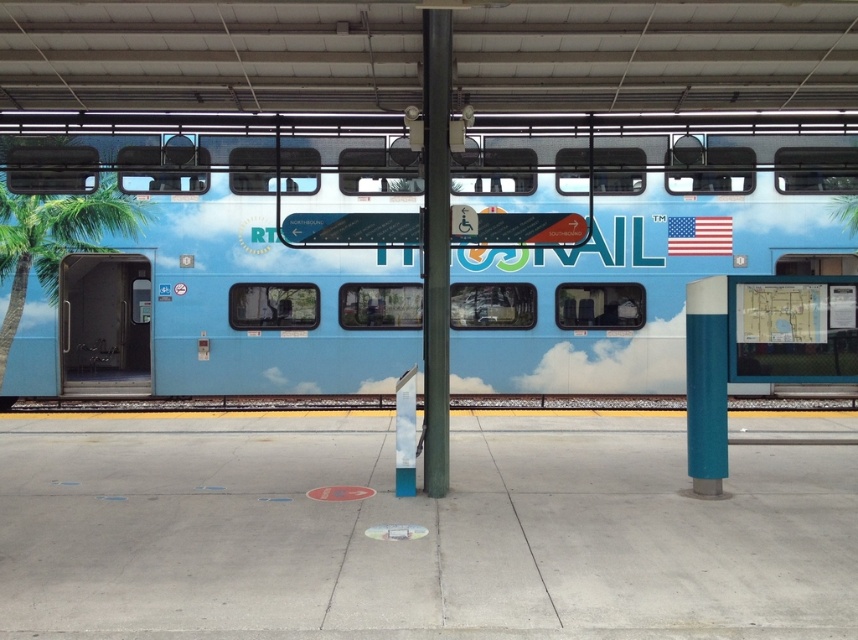
Can you confirm if light blue glossy train at center is smaller than green painted metal pole at center?

Incorrect, light blue glossy train at center is not smaller in size than green painted metal pole at center.

Can you confirm if light blue glossy train at center is positioned to the left of green painted metal pole at center?

Correct, you'll find light blue glossy train at center to the left of green painted metal pole at center.

Does point (813, 262) come behind point (433, 147)?

Yes, it is behind point (433, 147).

You are a GUI agent. You are given a task and a screenshot of the screen. Output one action in this format:
    pyautogui.click(x=<x>, y=<y>)
    Task: Click on the light blue glossy train at center
    The height and width of the screenshot is (640, 858).
    Given the screenshot: What is the action you would take?
    pyautogui.click(x=230, y=273)

Does point (536, 237) come behind point (22, 230)?

No, (536, 237) is closer to viewer.

At what (x,y) coordinates should I click in order to perform the action: click on light blue glossy train at center. Please return your answer as a coordinate pair (x, y). This screenshot has height=640, width=858. Looking at the image, I should click on (230, 273).

The width and height of the screenshot is (858, 640). Find the location of `green painted metal pole at center`. green painted metal pole at center is located at coordinates (434, 248).

Does point (438, 134) come behind point (5, 326)?

No, it is not.

Who is more forward, (446, 20) or (29, 240)?

Point (446, 20) is more forward.

Where is `green painted metal pole at center`? The width and height of the screenshot is (858, 640). green painted metal pole at center is located at coordinates (434, 248).